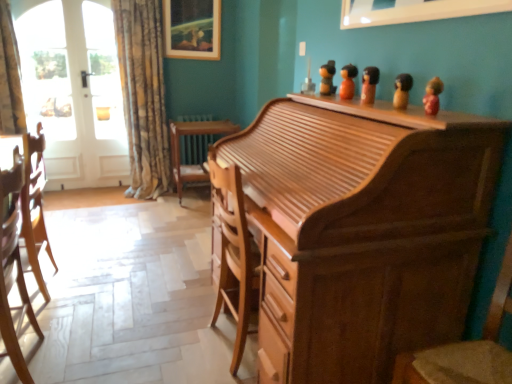
Question: From the image's perspective, relative to white glass door at left, is wooden roll-top desk at center above or below?

Choices:
 (A) below
 (B) above

Answer: (A)

Question: Is wooden roll-top desk at center to the left or to the right of white glass door at left in the image?

Choices:
 (A) right
 (B) left

Answer: (A)

Question: Considering the real-world distances, which object is farthest from the light brown wood chair at left, which is counted as the 1th chair, starting from the back?

Choices:
 (A) white glossy picture frame at upper center, which is the first picture frame in bottom-to-top order
 (B) wooden picture frame at upper center, the 1th picture frame in the left-to-right sequence
 (C) white glass door at left
 (D) white glossy door at left
 (E) textured beige curtain at left

Answer: (B)

Question: Based on their relative distances, which object is farther from the light brown wood chair at left, acting as the 2th chair starting from the right?

Choices:
 (A) white glossy picture frame at upper center, the 1th picture frame in the front-to-back sequence
 (B) white glass door at left
 (C) textured beige curtain at left
 (D) wooden chair at center
 (E) white glossy door at left

Answer: (B)